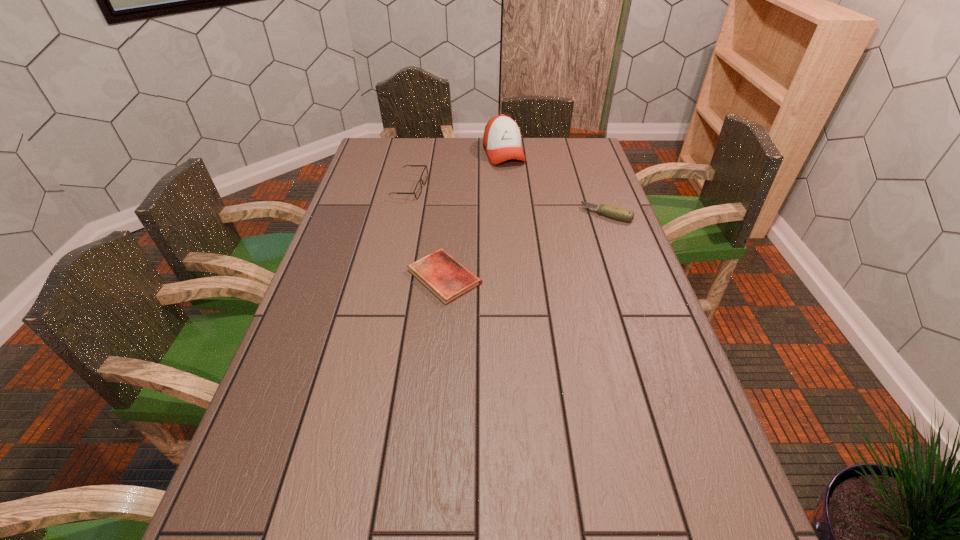
The image size is (960, 540). I want to click on free space on the desktop that is between the nearest object and the rightmost object and is positioned on the front-facing side of the second object from right to left, so click(x=545, y=238).

At what (x,y) coordinates should I click in order to perform the action: click on free space on the desktop that is between the shortest object and the rightmost object and is positioned with the lenses facing outward on the spectacles. Please return your answer as a coordinate pair (x, y). Looking at the image, I should click on (528, 245).